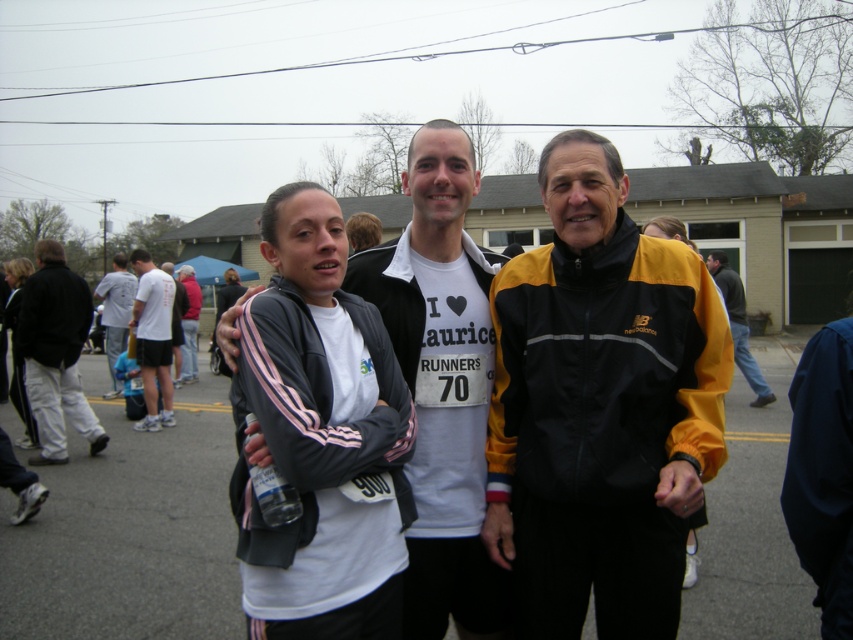
Who is higher up, yellow/black new balance jacket at center or white cotton t-shirt at center?

Positioned higher is white cotton t-shirt at center.

Does point (619, 244) lie in front of point (457, 394)?

Yes, point (619, 244) is in front of point (457, 394).

At what (x,y) coordinates should I click in order to perform the action: click on yellow/black new balance jacket at center. Please return your answer as a coordinate pair (x, y). The height and width of the screenshot is (640, 853). Looking at the image, I should click on (601, 406).

Does black cotton pants at left have a lesser height compared to white t-shirt at center?

Indeed, black cotton pants at left has a lesser height compared to white t-shirt at center.

Which is more to the left, black cotton pants at left or white t-shirt at center?

From the viewer's perspective, white t-shirt at center appears more on the left side.

Between point (48, 376) and point (106, 342), which one is positioned behind?

Point (106, 342)

This screenshot has height=640, width=853. Identify the location of black cotton pants at left. (56, 353).

Who is more forward, (x=729, y=291) or (x=103, y=316)?

Positioned in front is point (x=729, y=291).

Which is more to the left, yellow/black jacket at center or white t-shirt at center?

Positioned to the left is white t-shirt at center.

Where is `yellow/black jacket at center`? This screenshot has width=853, height=640. yellow/black jacket at center is located at coordinates click(738, 324).

The width and height of the screenshot is (853, 640). Identify the location of yellow/black jacket at center. (738, 324).